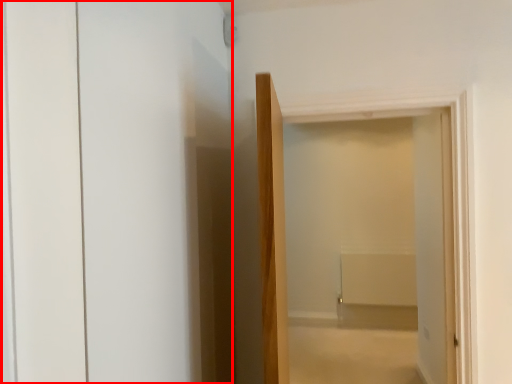
Question: From the image's perspective, considering the relative positions of screen door (annotated by the red box) and door in the image provided, where is screen door (annotated by the red box) located with respect to the staircase?

Choices:
 (A) below
 (B) above

Answer: (B)